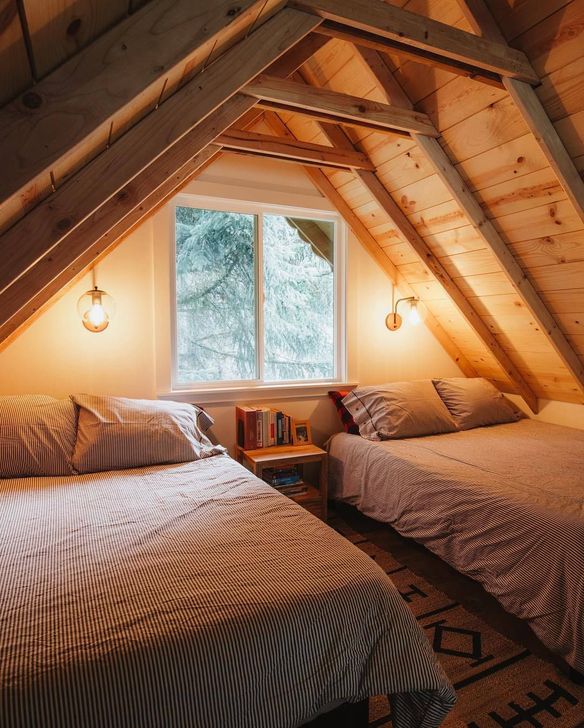
Find the location of a particular element. glass is located at coordinates (232, 301), (298, 304).